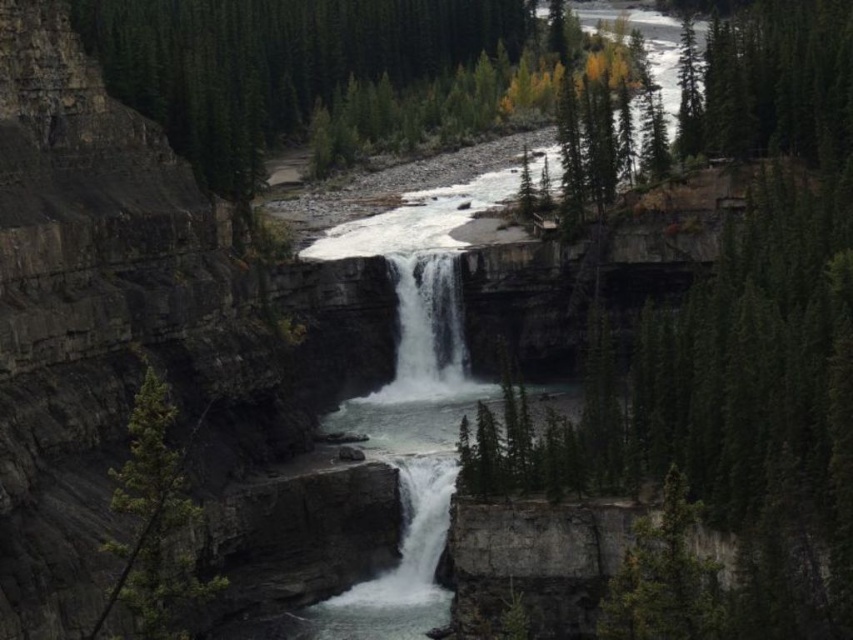
Question: Can you confirm if green textured tree at left is smaller than white frothy water at center?

Choices:
 (A) no
 (B) yes

Answer: (A)

Question: Does green textured tree at left have a greater width compared to white frothy water at center?

Choices:
 (A) no
 (B) yes

Answer: (B)

Question: Which of the following is the closest to the observer?

Choices:
 (A) white frothy water at center
 (B) green textured tree at left

Answer: (B)

Question: Which point is closer to the camera taking this photo?

Choices:
 (A) (412, 388)
 (B) (152, 476)

Answer: (B)

Question: Is green textured tree at left wider than white frothy water at center?

Choices:
 (A) yes
 (B) no

Answer: (A)

Question: Which object is farther from the camera taking this photo?

Choices:
 (A) white frothy water at center
 (B) green textured tree at left

Answer: (A)